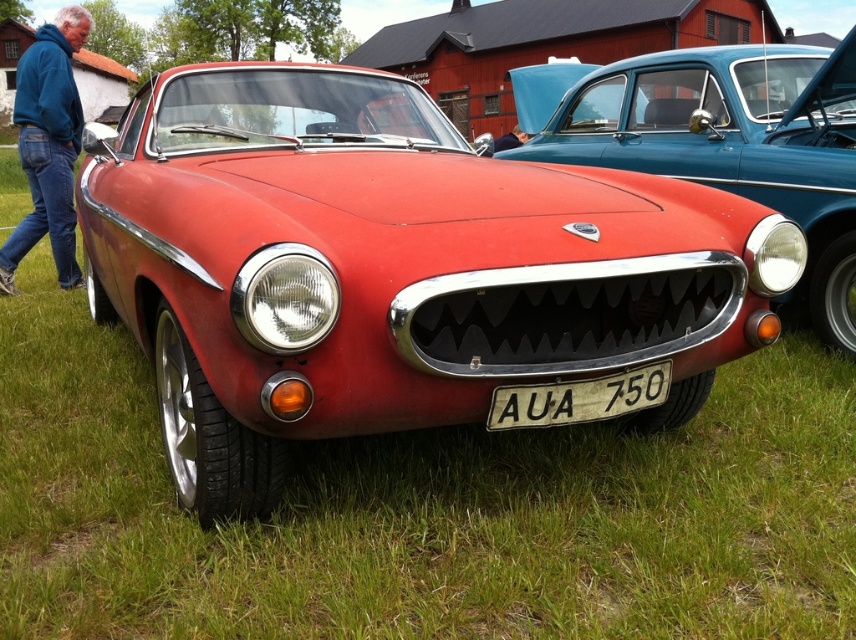
Which is in front, point (694, 141) or point (664, 380)?

Point (664, 380)

Which is more to the left, matte black car at center or white plastic license plate at center?

white plastic license plate at center is more to the left.

Is point (691, 177) positioned behind point (629, 388)?

Yes, point (691, 177) is farther from viewer.

Identify the location of matte black car at center. Image resolution: width=856 pixels, height=640 pixels. (734, 145).

Based on the photo, which of these two, blue fleece jacket at upper left or white plastic license plate at center, stands taller?

With more height is blue fleece jacket at upper left.

Which of these two, blue fleece jacket at upper left or white plastic license plate at center, stands shorter?

white plastic license plate at center is shorter.

At what (x,y) coordinates should I click in order to perform the action: click on blue fleece jacket at upper left. Please return your answer as a coordinate pair (x, y). The width and height of the screenshot is (856, 640). Looking at the image, I should click on tap(48, 145).

Does matte black car at center appear on the right side of blue fleece jacket at upper left?

Yes, matte black car at center is to the right of blue fleece jacket at upper left.

Is matte black car at center taller than blue fleece jacket at upper left?

No, matte black car at center is not taller than blue fleece jacket at upper left.

Is point (675, 84) farther from viewer compared to point (34, 241)?

No, (675, 84) is closer to viewer.

Identify the location of matte black car at center. Image resolution: width=856 pixels, height=640 pixels. (734, 145).